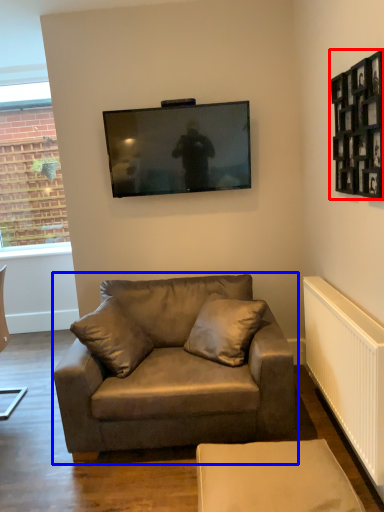
Question: Which of the following is the closest to the observer, picture frame (highlighted by a red box) or studio couch (highlighted by a blue box)?

Choices:
 (A) picture frame
 (B) studio couch

Answer: (A)